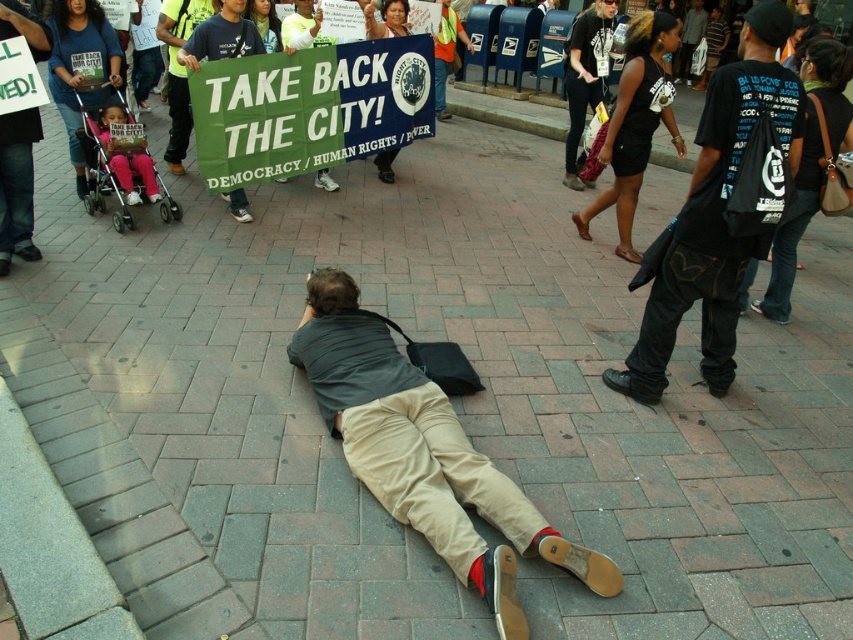
What is located at the coordinates point (424, 452) in the image?

The khaki cotton pants at center is located at point (424, 452).